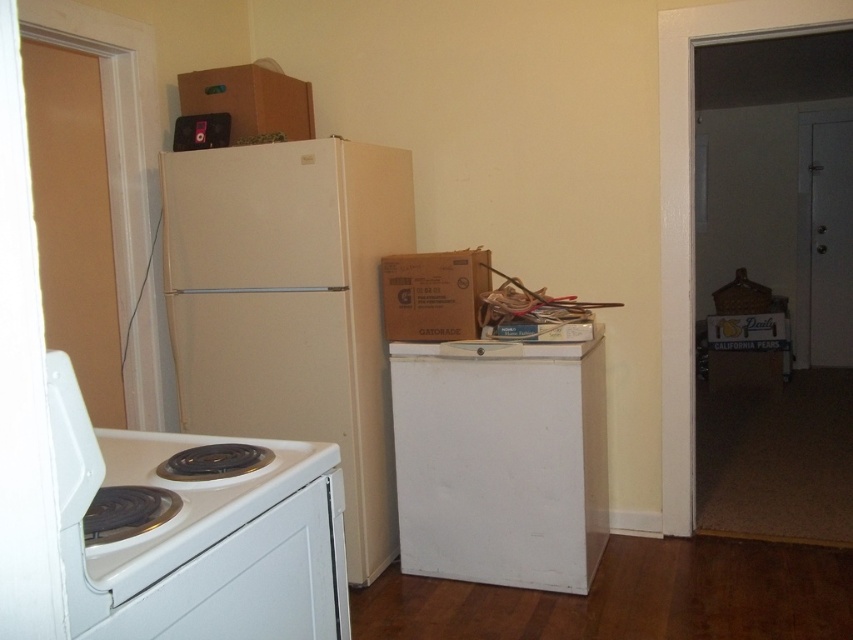
You are organizing items on the kitchen counter and need to place a new appliance that requires space equal to the white matte refrigerator at center. Can the cardboard box at upper center accommodate this appliance?

The white matte refrigerator at center is wider than the cardboard box at upper center, so the cardboard box at upper center cannot accommodate the appliance since it is narrower than the refrigerator.

You are organizing items in a retro kitchen. You need to place a new item between the white matte mini fridge at center and the cardboard box at upper center. Where should you place it?

Since the white matte mini fridge at center is to the right of the cardboard box at upper center, you should place the new item between them, ensuring it is positioned to the right of the cardboard box at upper center and to the left of the white matte mini fridge at center.

You are standing in the kitchen and want to place a small object on the point that is closer to you. Which point should you choose between point (326, 180) and point (281, 88)?

Point (326, 180) is closer to the camera than point (281, 88), so you should choose point (326, 180) to place the small object.